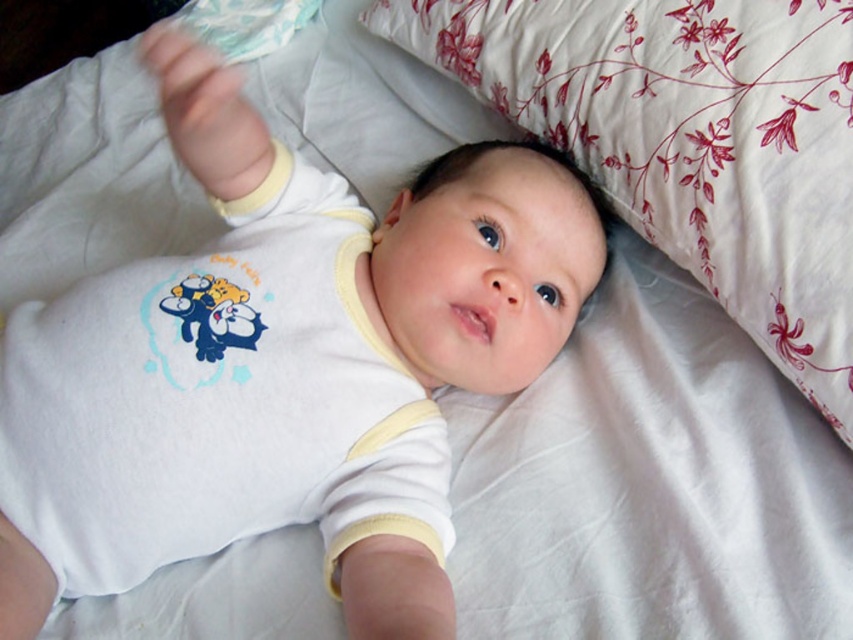
You are a photographer setting up for a baby photo shoot. The baby is lying on a bed with a white floral pillow at upper center. To ensure the pillow is centered in the frame, where should you position your camera relative to the pillow?

The white floral pillow at upper center is located at point (689, 141), so you should position your camera directly in front of the pillow at those coordinates to center it in the frame.

You are holding a small toy that needs to be placed exactly 60 centimeters away from where you are standing. Based on the image, can you use the point marked at coordinates point [804,250] to determine if it is within the required distance?

The point marked at coordinates point [804,250] is 63.45 centimeters from the viewer, which is slightly farther than the required 60 centimeters. Therefore, placing the toy at this point would not meet the distance requirement.

You are a photographer setting up a shot of the baby. You want to focus on the white cotton onesie at center without the white floral pillow at upper center blocking the view. Can you adjust your position to do this?

The white floral pillow at upper center is further to the viewer than the white cotton onesie at center, so moving your camera position slightly lower or to the side might allow you to avoid the pillow blocking the onesie.